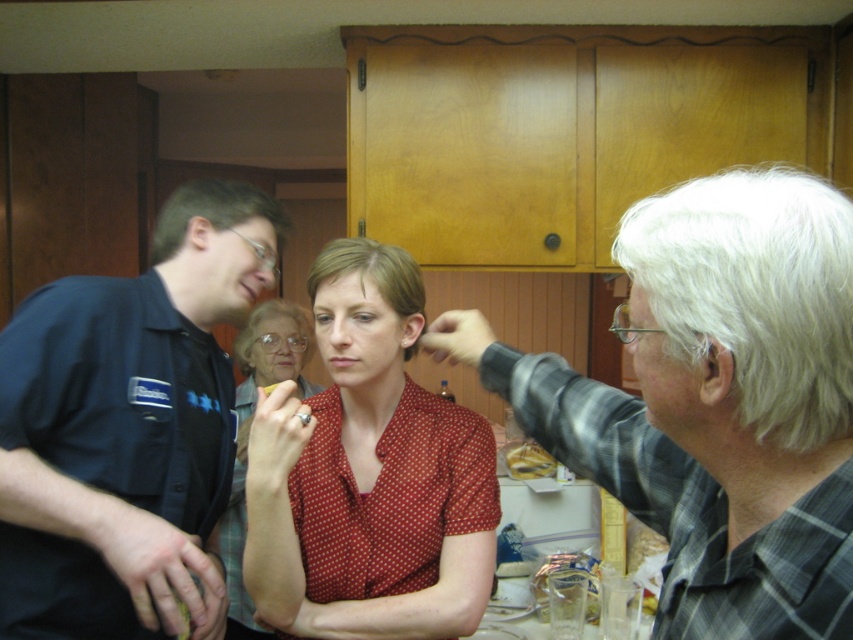
Describe the element at coordinates (717, 401) in the screenshot. I see `gray plaid shirt at upper right` at that location.

Does gray plaid shirt at upper right have a greater width compared to dark blue shirt at left?

Yes.

The image size is (853, 640). Describe the element at coordinates (717, 401) in the screenshot. I see `gray plaid shirt at upper right` at that location.

Where is `gray plaid shirt at upper right`? This screenshot has height=640, width=853. gray plaid shirt at upper right is located at coordinates (717, 401).

Is gray plaid shirt at upper right bigger than golden brown bread at center?

Indeed, gray plaid shirt at upper right has a larger size compared to golden brown bread at center.

Does point (752, 349) lie in front of point (540, 452)?

Yes, point (752, 349) is in front of point (540, 452).

Locate an element on the screen. The image size is (853, 640). gray plaid shirt at upper right is located at coordinates (717, 401).

Who is higher up, dark blue shirt at left or red dotted shirt at center?

dark blue shirt at left is higher up.

Find the location of a particular element. The image size is (853, 640). dark blue shirt at left is located at coordinates (128, 428).